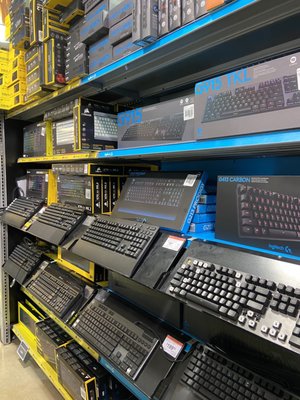
You are a GUI agent. You are given a task and a screenshot of the screen. Output one action in this format:
    pyautogui.click(x=<x>, y=<y>)
    Task: Click on the yellow edge on shelf
    The image size is (300, 400).
    Given the screenshot: What is the action you would take?
    pyautogui.click(x=42, y=369), pyautogui.click(x=22, y=335), pyautogui.click(x=60, y=387)